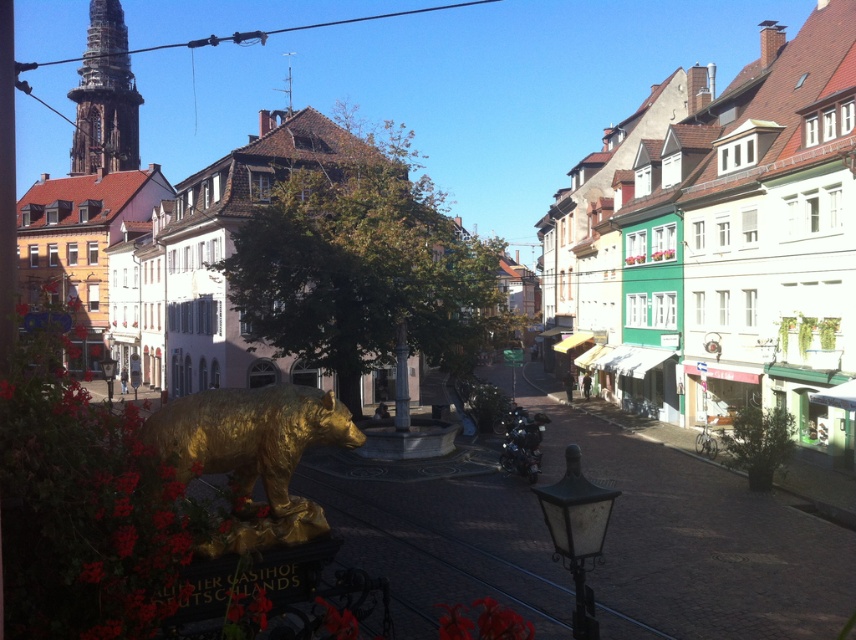
Question: Among these points, which one is farthest from the camera?

Choices:
 (A) [200, 464]
 (B) [114, 129]

Answer: (B)

Question: Is gold metallic bear at center below golden stone tower at upper left?

Choices:
 (A) no
 (B) yes

Answer: (B)

Question: Can you confirm if gold metallic bear at center is wider than golden stone tower at upper left?

Choices:
 (A) yes
 (B) no

Answer: (B)

Question: Which point is farther from the camera taking this photo?

Choices:
 (A) (129, 97)
 (B) (204, 392)

Answer: (A)

Question: Can you confirm if gold metallic bear at center is positioned to the left of golden stone tower at upper left?

Choices:
 (A) yes
 (B) no

Answer: (B)

Question: Which of the following is the closest to the observer?

Choices:
 (A) (278, 422)
 (B) (111, 161)

Answer: (A)